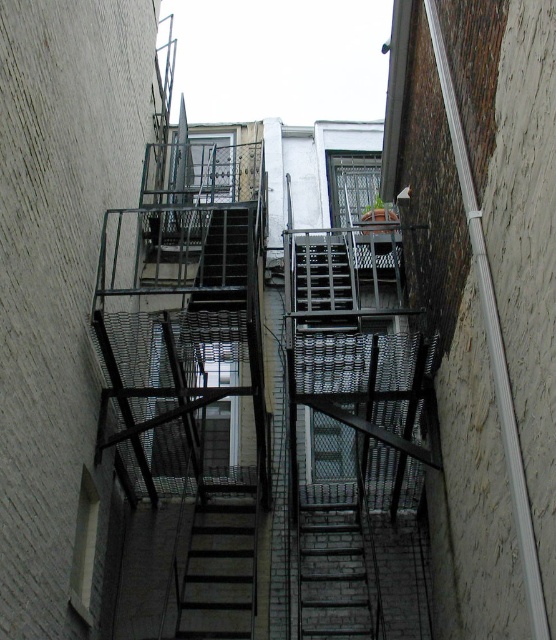
Is brick stairs at center thinner than metallic gray stairs at center?

No.

Consider the image. Who is more distant from viewer, (307, 570) or (230, 513)?

Point (230, 513)

At what (x,y) coordinates should I click in order to perform the action: click on brick stairs at center. Please return your answer as a coordinate pair (x, y). The height and width of the screenshot is (640, 556). Looking at the image, I should click on (335, 564).